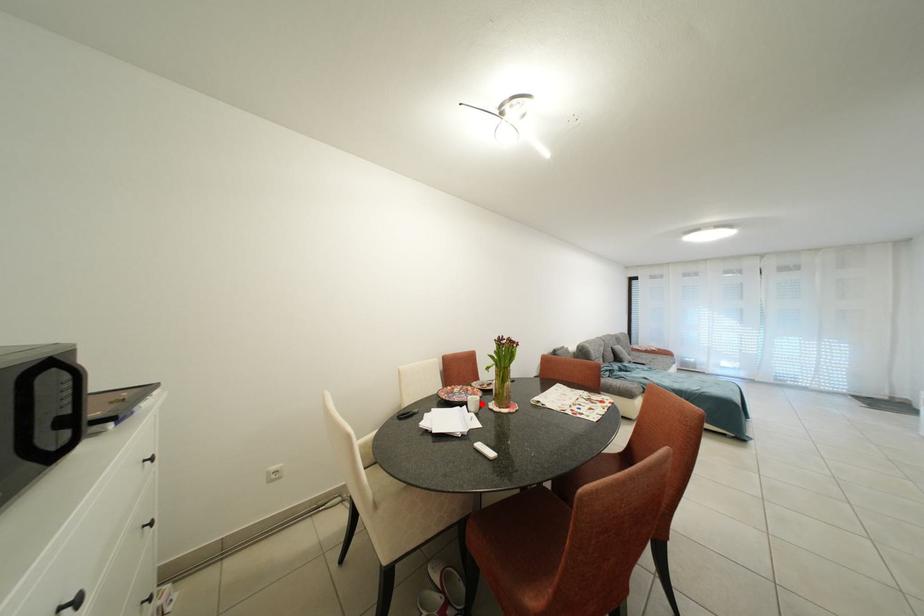
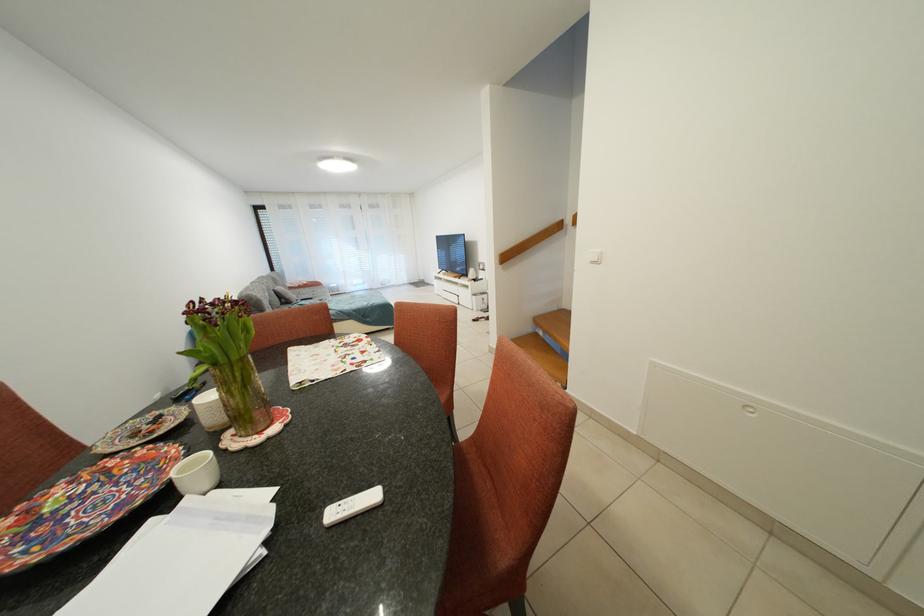
In the second image, find the point that corresponds to the highlighted location in the first image.

(202, 471)